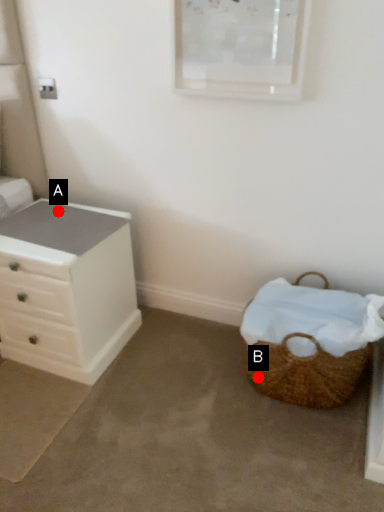
Question: Two points are circled on the image, labeled by A and B beside each circle. Which point is closer to the camera?

Choices:
 (A) A is closer
 (B) B is closer

Answer: (B)